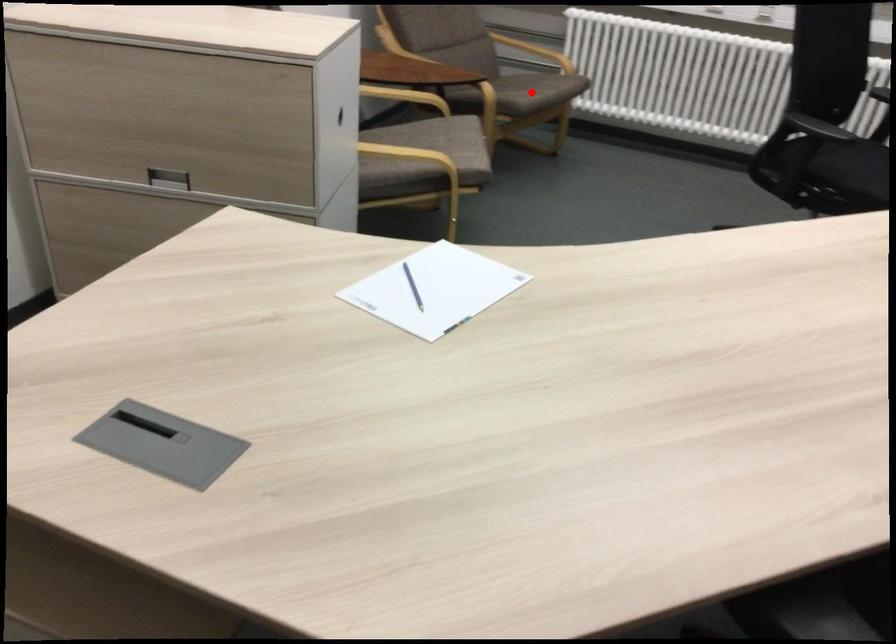
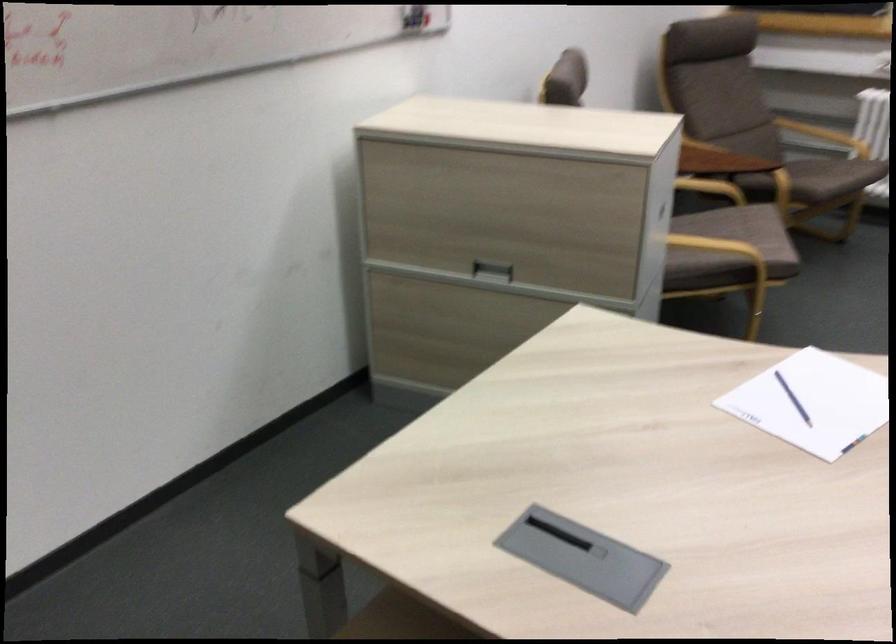
Where in the second image is the point corresponding to the highlighted location from the first image?

(831, 176)